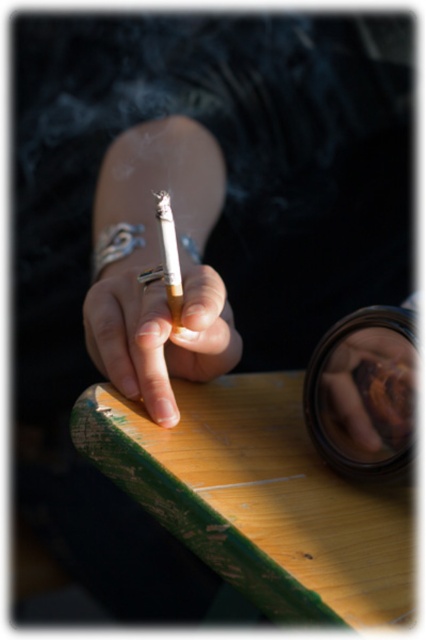
You are a photographer trying to capture the matte brown cigarette at center without the matte yellow wood at center blocking it. Can you move your camera position to achieve this?

The matte brown cigarette at center is behind the matte yellow wood at center, so moving the camera position might allow you to capture the cigarette without the wood blocking it by adjusting the angle or perspective.

You are a photographer trying to capture the cigarette in the scene. Since the matte yellow wood at center and the matte brown cigarette at center are both in focus, can you determine which object is closer to the camera?

The matte yellow wood at center is located below the matte brown cigarette at center, so the cigarette is closer to the camera than the wood.